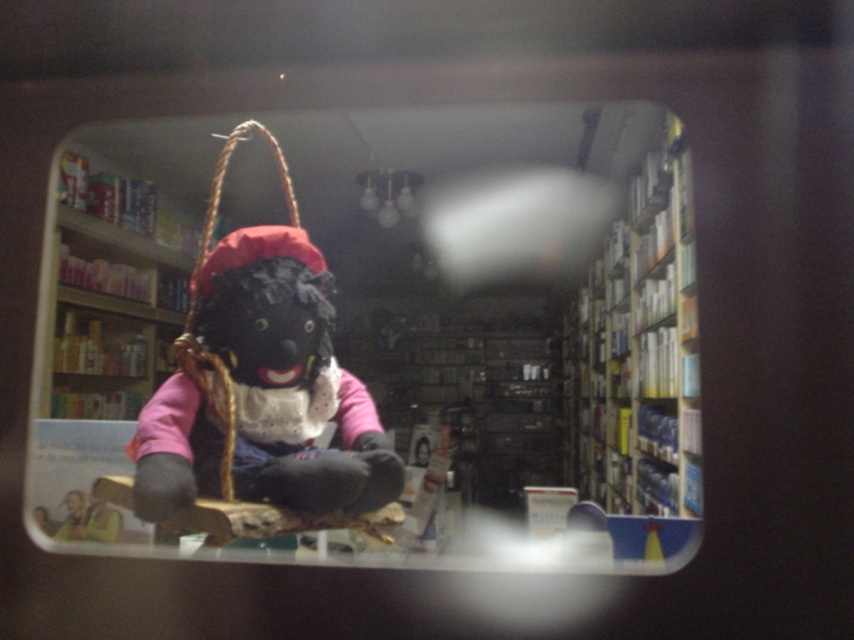
Which is more to the right, velvet plush doll at center or matte black doll at center?

From the viewer's perspective, velvet plush doll at center appears more on the right side.

Between velvet plush doll at center and matte black doll at center, which one is positioned lower?

velvet plush doll at center

Between point (219, 220) and point (381, 438), which one is positioned behind?

The point (219, 220) is behind.

Where is `velvet plush doll at center`? The image size is (854, 640). velvet plush doll at center is located at coordinates (366, 336).

Between matte black doll at center and white cardboard bookshelf at right, which one has less height?

matte black doll at center is shorter.

Is point (162, 388) positioned in front of point (665, 225)?

Yes, point (162, 388) is in front of point (665, 225).

Where is `matte black doll at center`? The height and width of the screenshot is (640, 854). matte black doll at center is located at coordinates (261, 392).

Between velvet plush doll at center and white cardboard bookshelf at right, which one is positioned lower?

velvet plush doll at center

The width and height of the screenshot is (854, 640). What do you see at coordinates (366, 336) in the screenshot? I see `velvet plush doll at center` at bounding box center [366, 336].

I want to click on velvet plush doll at center, so click(366, 336).